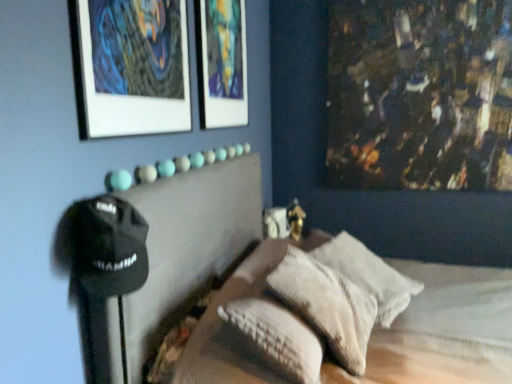
Question: From the image's perspective, does textured beige pillow at center, the second pillow positioned from the back, appear lower than matte glass picture frame at upper center, acting as the first picture frame starting from the right?

Choices:
 (A) no
 (B) yes

Answer: (B)

Question: Does textured beige pillow at center, the 1th pillow in the front-to-back sequence, have a greater width compared to matte glass picture frame at upper center, the 2th picture frame when ordered from left to right?

Choices:
 (A) yes
 (B) no

Answer: (A)

Question: Is textured beige pillow at center, the 1th pillow in the front-to-back sequence, behind matte glass picture frame at upper center, acting as the first picture frame starting from the right?

Choices:
 (A) yes
 (B) no

Answer: (B)

Question: Does textured beige pillow at center, the second pillow positioned from the back, appear on the right side of matte glass picture frame at upper center, the first picture frame positioned from the back?

Choices:
 (A) yes
 (B) no

Answer: (A)

Question: Considering the relative positions of textured beige pillow at center, the 1th pillow in the front-to-back sequence, and matte glass picture frame at upper center, the 2th picture frame from the front, in the image provided, is textured beige pillow at center, the 1th pillow in the front-to-back sequence, to the left of matte glass picture frame at upper center, the 2th picture frame from the front, from the viewer's perspective?

Choices:
 (A) no
 (B) yes

Answer: (A)

Question: Is textured beige pillow at center, the 1th pillow in the front-to-back sequence, wider or thinner than white textured pillow at center, the second pillow in the front-to-back sequence?

Choices:
 (A) wide
 (B) thin

Answer: (B)

Question: Considering their positions, is textured beige pillow at center, the 1th pillow in the front-to-back sequence, located in front of or behind white textured pillow at center, which appears as the 1th pillow when viewed from the back?

Choices:
 (A) front
 (B) behind

Answer: (A)

Question: Considering the positions of point (335, 302) and point (337, 244), is point (335, 302) closer or farther from the camera than point (337, 244)?

Choices:
 (A) farther
 (B) closer

Answer: (B)

Question: Is textured beige pillow at center, the second pillow positioned from the back, taller or shorter than white textured pillow at center, which appears as the 1th pillow when viewed from the back?

Choices:
 (A) tall
 (B) short

Answer: (A)

Question: Is matte glass picture frame at upper center, the 2th picture frame when ordered from left to right, bigger or smaller than matte white picture frame at upper left, arranged as the 1th picture frame when viewed from the left?

Choices:
 (A) small
 (B) big

Answer: (B)

Question: Is matte glass picture frame at upper center, acting as the first picture frame starting from the right, spatially inside matte white picture frame at upper left, arranged as the 1th picture frame when viewed from the left, or outside of it?

Choices:
 (A) inside
 (B) outside

Answer: (B)

Question: Does point pos(231,77) appear closer or farther from the camera than point pos(151,26)?

Choices:
 (A) farther
 (B) closer

Answer: (A)

Question: In terms of height, does matte glass picture frame at upper center, the 2th picture frame when ordered from left to right, look taller or shorter compared to matte white picture frame at upper left, arranged as the 1th picture frame when viewed from the left?

Choices:
 (A) short
 (B) tall

Answer: (B)

Question: Is textured beige pillow at center, the second pillow positioned from the back, wider or thinner than matte glass picture frame at upper center, acting as the first picture frame starting from the right?

Choices:
 (A) thin
 (B) wide

Answer: (B)

Question: From a real-world perspective, relative to matte glass picture frame at upper center, the 2th picture frame from the front, is textured beige pillow at center, the 1th pillow in the front-to-back sequence, vertically above or below?

Choices:
 (A) above
 (B) below

Answer: (B)